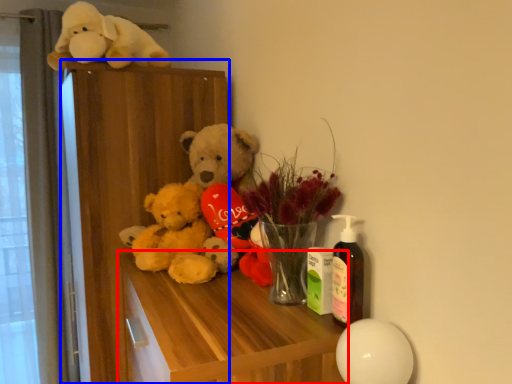
Question: Which object is further to the camera taking this photo, table (highlighted by a red box) or dresser (highlighted by a blue box)?

Choices:
 (A) table
 (B) dresser

Answer: (B)